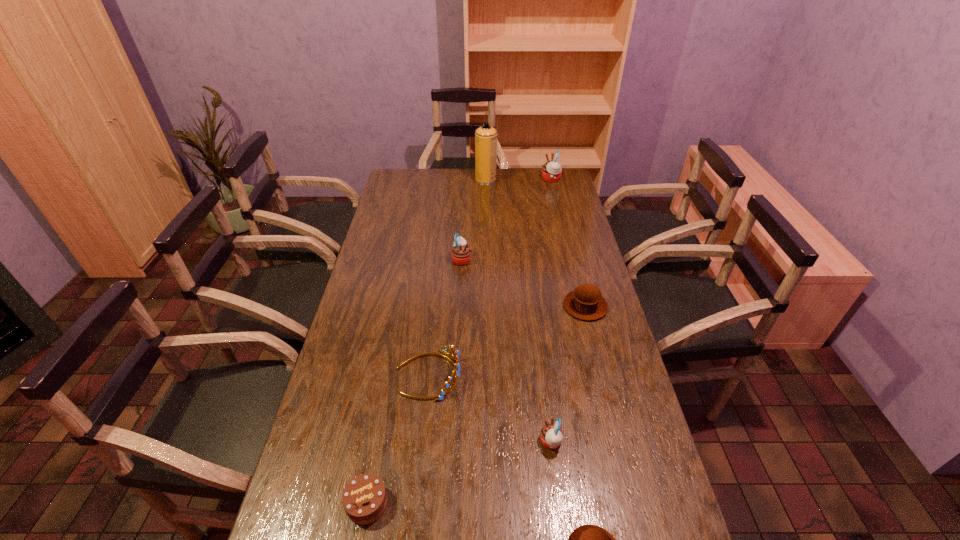
You are a GUI agent. You are given a task and a screenshot of the screen. Output one action in this format:
    pyautogui.click(x=<x>, y=<y>)
    Task: Click on the free spot between the brown chocolate cake and the aerosol can
    The height and width of the screenshot is (540, 960).
    Given the screenshot: What is the action you would take?
    pyautogui.click(x=426, y=342)

Identify which object is the closest to the nearest muffin. Please provide its 2D coordinates. Your answer should be formatted as a tuple, i.e. [(x, y)], where the tuple contains the x and y coordinates of a point satisfying the conditions above.

[(551, 435)]

Identify which object is located as the seventh nearest to the gold tiara. Please provide its 2D coordinates. Your answer should be formatted as a tuple, i.e. [(x, y)], where the tuple contains the x and y coordinates of a point satisfying the conditions above.

[(551, 171)]

Locate which muffin is the closest to the tallest object. Please provide its 2D coordinates. Your answer should be formatted as a tuple, i.e. [(x, y)], where the tuple contains the x and y coordinates of a point satisfying the conditions above.

[(551, 171)]

I want to click on muffin that is the closest one to the leftmost pink muffin, so click(x=586, y=302).

I want to click on pink muffin that is the second closest to the second farthest muffin, so pos(551,435).

Locate which pink muffin ranks second in proximity to the nearer brown muffin. Please provide its 2D coordinates. Your answer should be formatted as a tuple, i.e. [(x, y)], where the tuple contains the x and y coordinates of a point satisfying the conditions above.

[(461, 253)]

This screenshot has height=540, width=960. What are the coordinates of `free location that satisfies the following two spatial constraints: 1. on the front-facing side of the third farthest muffin; 2. on the right side of the second tallest muffin` in the screenshot? It's located at (459, 306).